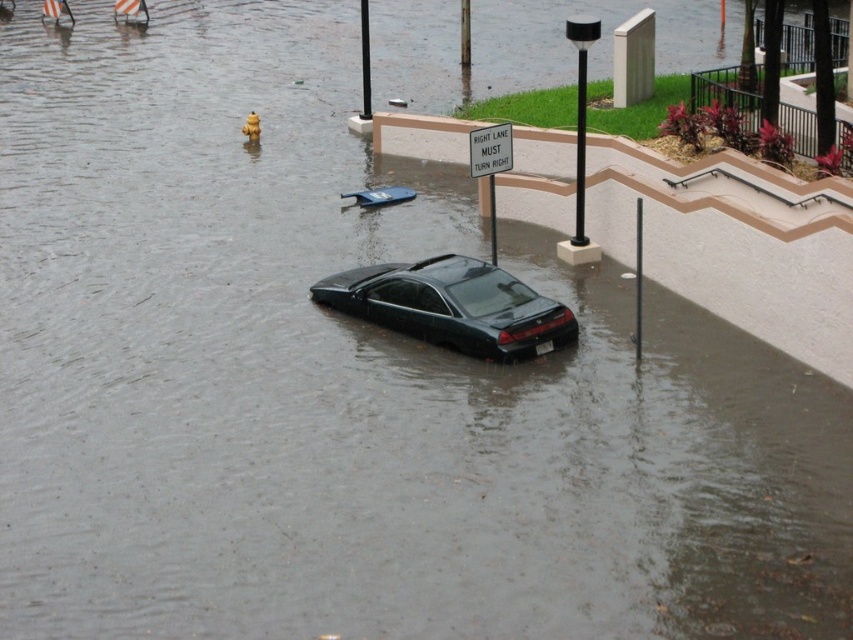
Does point (399, 314) lie in front of point (485, 134)?

Yes, it is in front of point (485, 134).

Identify the location of dark gray matte car at center. (451, 305).

Identify the location of dark gray matte car at center. This screenshot has width=853, height=640. (451, 305).